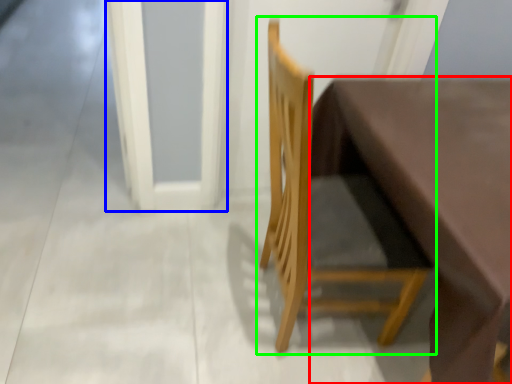
Question: Estimate the real-world distances between objects in this image. Which object is farther from table (highlighted by a red box), screen door (highlighted by a blue box) or chair (highlighted by a green box)?

Choices:
 (A) screen door
 (B) chair

Answer: (A)